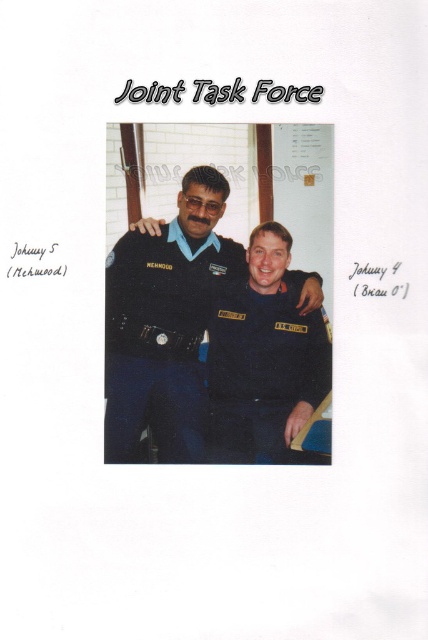
Does matte black uniform at center appear on the left side of dark blue fabric uniform at center?

Correct, you'll find matte black uniform at center to the left of dark blue fabric uniform at center.

Is matte black uniform at center below dark blue fabric uniform at center?

No, matte black uniform at center is not below dark blue fabric uniform at center.

Measure the distance between matte black uniform at center and camera.

They are 4.60 feet apart.

Image resolution: width=428 pixels, height=640 pixels. I want to click on matte black uniform at center, so click(x=166, y=323).